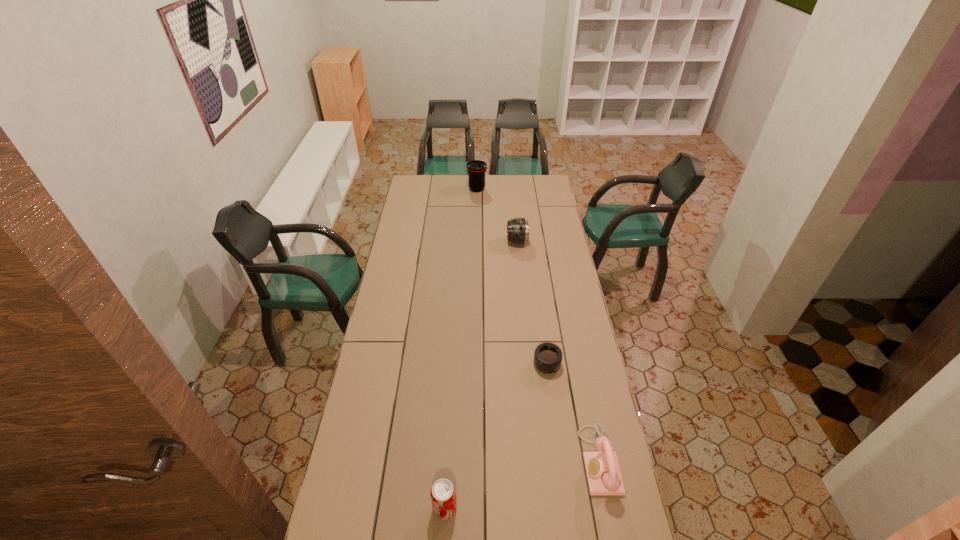
Find the location of a particular element. The width and height of the screenshot is (960, 540). empty space between the telephone and the soda can is located at coordinates (522, 484).

Where is `vacant space that's between the telephone and the soda can`? Image resolution: width=960 pixels, height=540 pixels. vacant space that's between the telephone and the soda can is located at coordinates (522, 484).

Where is `vacant space that is in between the rightmost object and the farthest telephoto lens`? The height and width of the screenshot is (540, 960). vacant space that is in between the rightmost object and the farthest telephoto lens is located at coordinates (539, 325).

This screenshot has width=960, height=540. Find the location of `vacant area that lies between the soda can and the tallest object`. vacant area that lies between the soda can and the tallest object is located at coordinates (461, 348).

Select which object is the second closest to the telephone. Please provide its 2D coordinates. Your answer should be formatted as a tuple, i.e. [(x, y)], where the tuple contains the x and y coordinates of a point satisfying the conditions above.

[(443, 494)]

The image size is (960, 540). Identify the location of object identified as the third closest to the telephone. (518, 228).

Point out which telephoto lens is positioned as the second nearest to the farthest telephoto lens. Please provide its 2D coordinates. Your answer should be formatted as a tuple, i.e. [(x, y)], where the tuple contains the x and y coordinates of a point satisfying the conditions above.

[(548, 357)]

This screenshot has height=540, width=960. I want to click on the closest telephoto lens to the telephone, so click(548, 357).

This screenshot has width=960, height=540. What are the coordinates of `vacant position in the image that satisfies the following two spatial constraints: 1. at the front element of the second nearest telephoto lens; 2. on the front side of the soda can` in the screenshot? It's located at coord(544,508).